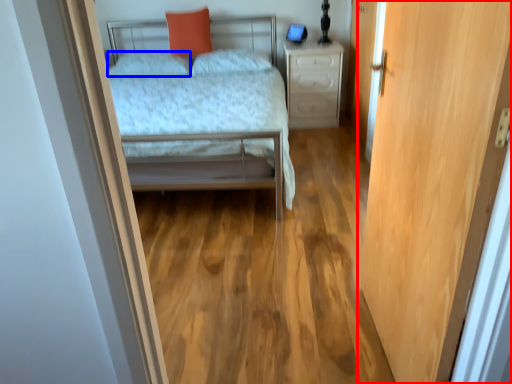
Question: Which of the following is the farthest to the observer, door (highlighted by a red box) or pillow (highlighted by a blue box)?

Choices:
 (A) door
 (B) pillow

Answer: (B)